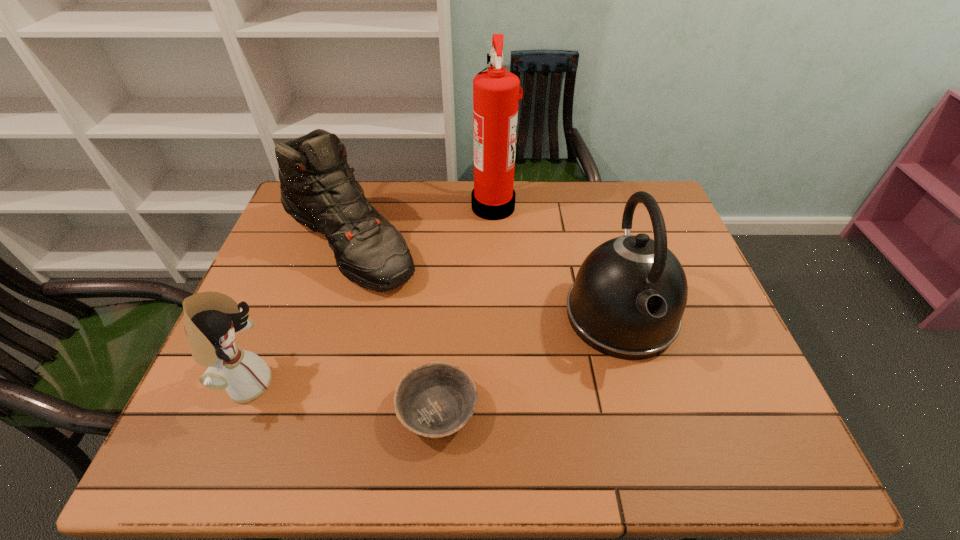
Where is `free spot that satisfies the following two spatial constraints: 1. at the front face of the second shortest object; 2. on the right side of the shortest object`? free spot that satisfies the following two spatial constraints: 1. at the front face of the second shortest object; 2. on the right side of the shortest object is located at coordinates (235, 411).